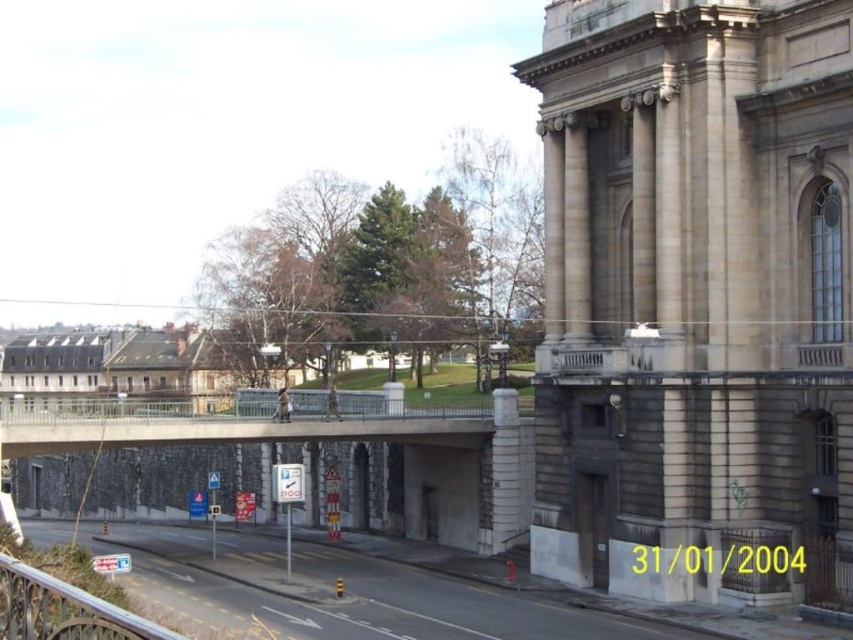
Image resolution: width=853 pixels, height=640 pixels. What do you see at coordinates (233, 428) in the screenshot? I see `metallic gray bridge at center` at bounding box center [233, 428].

Consider the image. Who is lower down, metallic gray bridge at center or metallic silver railing at lower left?

metallic silver railing at lower left

Is point (112, 436) less distant than point (62, 620)?

That is False.

This screenshot has width=853, height=640. Find the location of `metallic gray bridge at center`. metallic gray bridge at center is located at coordinates (233, 428).